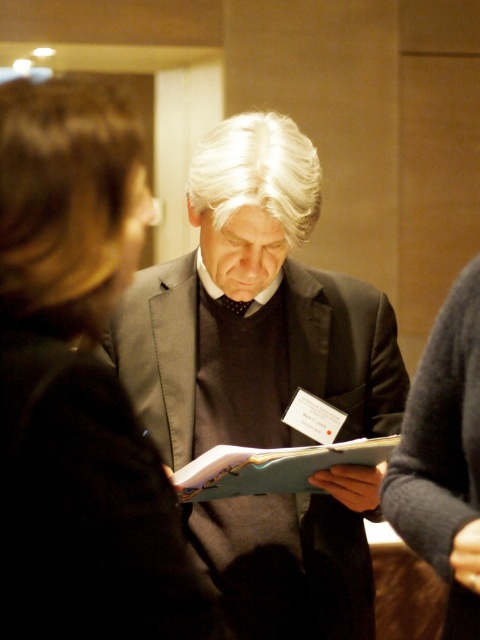
Does matte black suit at center have a lesser width compared to dark brown leather jacket at left?

No, matte black suit at center is not thinner than dark brown leather jacket at left.

Is matte black suit at center taller than dark brown leather jacket at left?

Yes.

Who is more distant from viewer, (340, 380) or (189, 602)?

Positioned behind is point (340, 380).

Where is `matte black suit at center`? The image size is (480, 640). matte black suit at center is located at coordinates (252, 308).

Which of these two, matte black suit at center or blue matte folder at center, stands taller?

With more height is matte black suit at center.

Between matte black suit at center and blue matte folder at center, which one appears on the left side from the viewer's perspective?

Positioned to the left is matte black suit at center.

Is point (194, 438) positioned before point (392, 438)?

No, it is not.

Where is `matte black suit at center`? The width and height of the screenshot is (480, 640). matte black suit at center is located at coordinates (252, 308).

In the scene shown: Who is higher up, dark brown leather jacket at left or blue matte folder at center?

dark brown leather jacket at left is higher up.

Is dark brown leather jacket at left further to camera compared to blue matte folder at center?

No, it is not.

Between point (99, 500) and point (210, 460), which one is positioned in front?

Point (99, 500)

Locate an element on the screen. dark brown leather jacket at left is located at coordinates (79, 387).